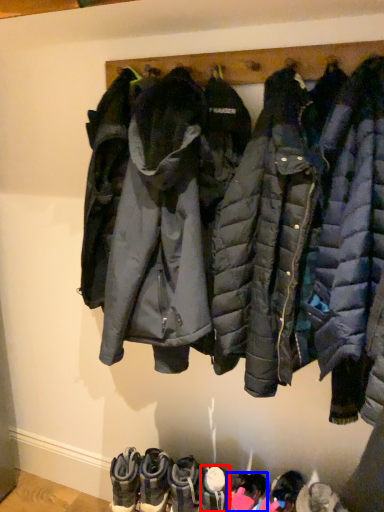
Question: Which object is further to the camera taking this photo, footwear (highlighted by a red box) or footwear (highlighted by a blue box)?

Choices:
 (A) footwear
 (B) footwear

Answer: (A)